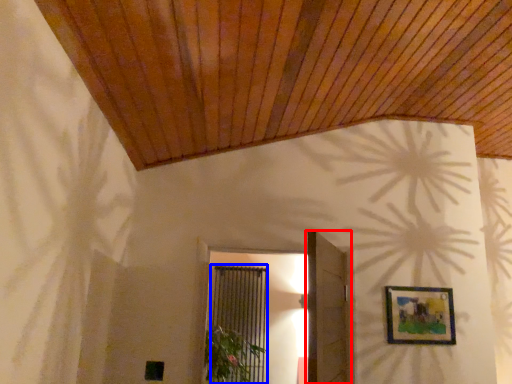
Question: Which object is closer to the camera taking this photo, door (highlighted by a red box) or screen door (highlighted by a blue box)?

Choices:
 (A) door
 (B) screen door

Answer: (A)